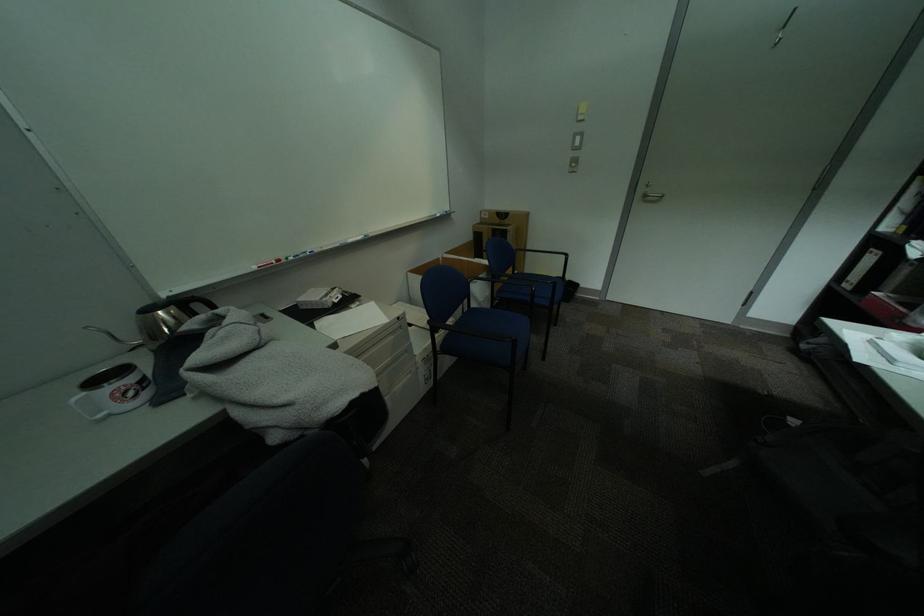
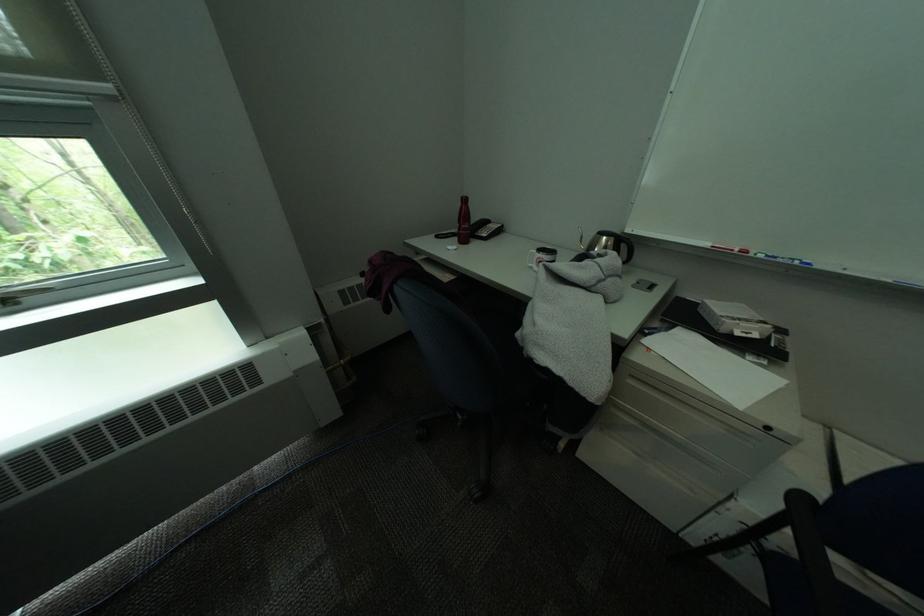
Find the pixel in the second image that matches point 312,257 in the first image.

(791, 262)